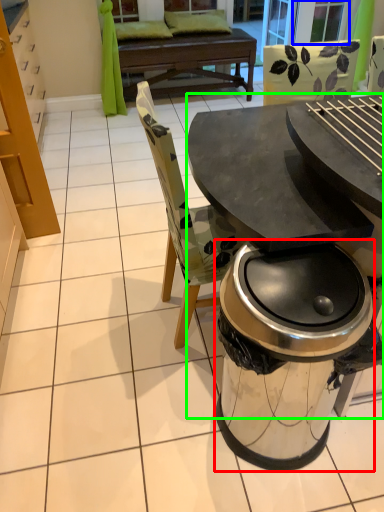
Question: Which is farther away from trash bin/can (highlighted by a red box)? screen door (highlighted by a blue box) or table (highlighted by a green box)?

Choices:
 (A) screen door
 (B) table

Answer: (A)